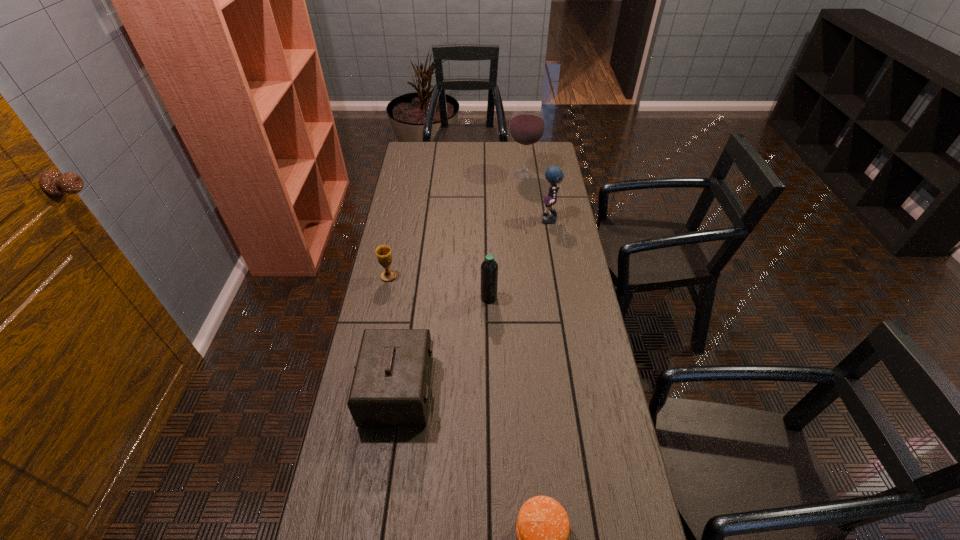
Point out which object is positioned as the fourth nearest to the patty. Please provide its 2D coordinates. Your answer should be formatted as a tuple, i.e. [(x, y)], where the tuple contains the x and y coordinates of a point satisfying the conditions above.

[(553, 174)]